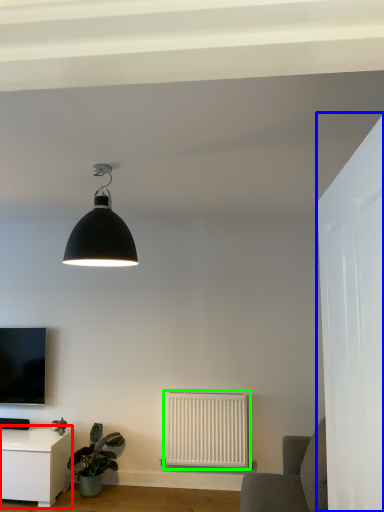
Question: Which is nearer to the table (highlighted by a red box)? glass door (highlighted by a blue box) or radiator (highlighted by a green box).

Choices:
 (A) glass door
 (B) radiator

Answer: (B)